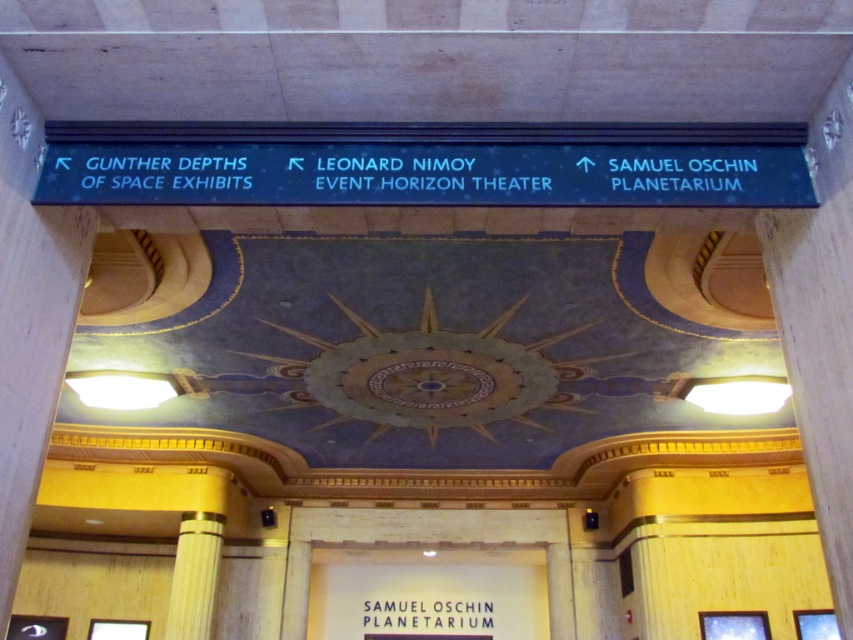
Can you confirm if blue glossy sign at upper center is positioned to the right of black matte samuel oschin planetarium at center?

Correct, you'll find blue glossy sign at upper center to the right of black matte samuel oschin planetarium at center.

Who is lower down, blue glossy sign at upper center or black matte samuel oschin planetarium at center?

black matte samuel oschin planetarium at center is lower down.

Between point (247, 164) and point (440, 612), which one is positioned behind?

The point (440, 612) is more distant.

At what (x,y) coordinates should I click in order to perform the action: click on blue glossy sign at upper center. Please return your answer as a coordinate pair (x, y). Looking at the image, I should click on (424, 173).

Is blue glossy sign at upper center above wooden pillar at center?

Yes.

Who is shorter, blue glossy sign at upper center or wooden pillar at center?

With less height is blue glossy sign at upper center.

Image resolution: width=853 pixels, height=640 pixels. Find the location of `blue glossy sign at upper center`. blue glossy sign at upper center is located at coordinates (424, 173).

Is wooden pillar at center to the right of black matte samuel oschin planetarium at center from the viewer's perspective?

In fact, wooden pillar at center is to the left of black matte samuel oschin planetarium at center.

At what (x,y) coordinates should I click in order to perform the action: click on wooden pillar at center. Please return your answer as a coordinate pair (x, y). Image resolution: width=853 pixels, height=640 pixels. Looking at the image, I should click on (194, 576).